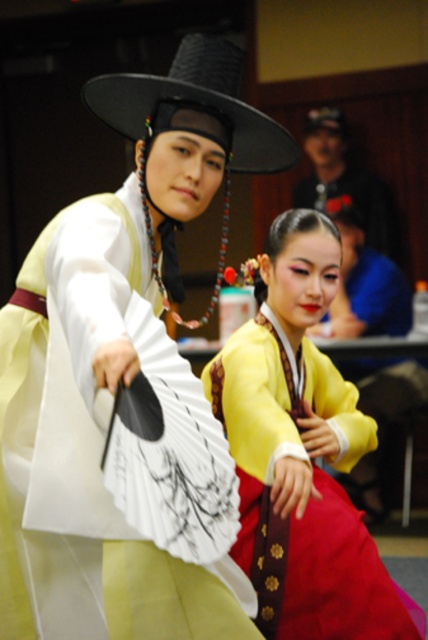
Question: Does yellow satin blouse at center come in front of white silk fan at center?

Choices:
 (A) no
 (B) yes

Answer: (A)

Question: Can you confirm if white silk fan at center is positioned below matte black hat at upper center?

Choices:
 (A) no
 (B) yes

Answer: (B)

Question: Which of the following is the closest to the observer?

Choices:
 (A) (x=308, y=154)
 (B) (x=127, y=234)

Answer: (B)

Question: Does yellow satin blouse at center come behind white silk fan at center?

Choices:
 (A) yes
 (B) no

Answer: (A)

Question: Which object is farther from the camera taking this photo?

Choices:
 (A) white silk fan at center
 (B) yellow satin blouse at center
 (C) matte black hat at upper center

Answer: (C)

Question: Which is nearer to the white silk fan at center?

Choices:
 (A) matte black hat at upper center
 (B) yellow satin blouse at center

Answer: (B)